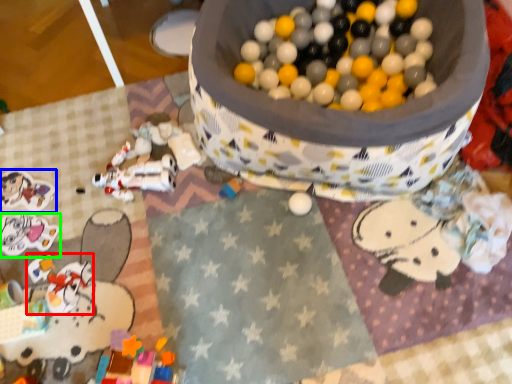
Question: Which object is the farthest from toy (highlighted by a red box)? Choose among these: toy (highlighted by a blue box) or toy (highlighted by a green box).

Choices:
 (A) toy
 (B) toy

Answer: (A)